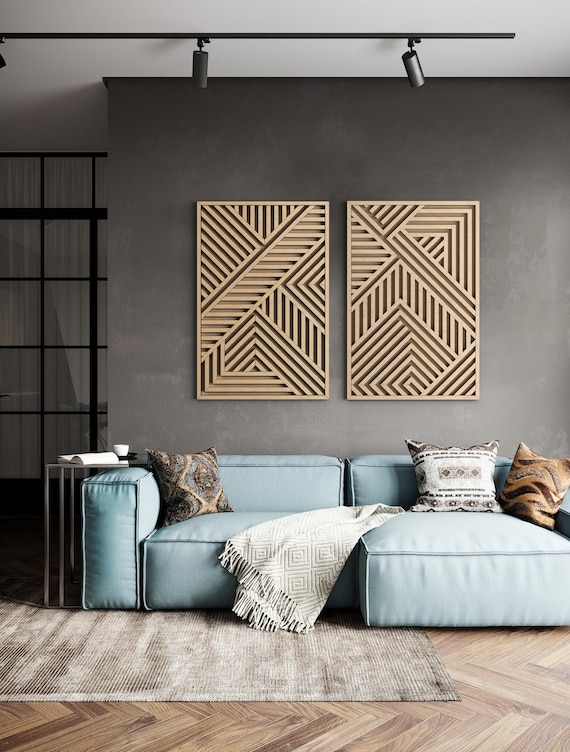
Find the location of `wood floor`. wood floor is located at coordinates (473, 699).